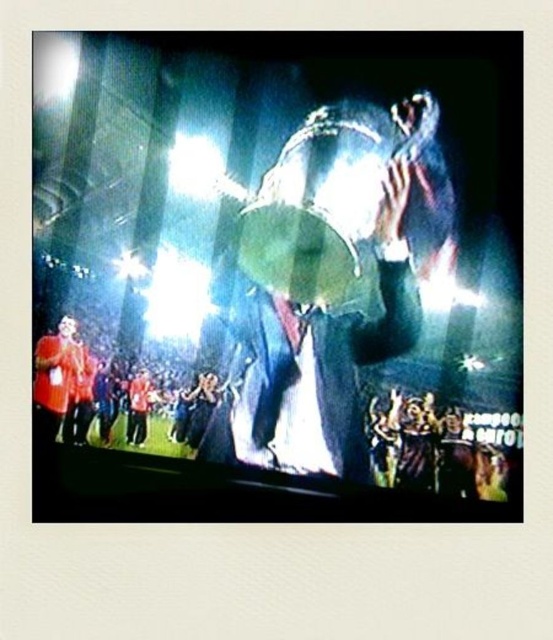
Question: Does metallic trophy at center appear on the right side of shiny silver drum at center?

Choices:
 (A) no
 (B) yes

Answer: (A)

Question: Which of the following is the closest to the observer?

Choices:
 (A) (267, 224)
 (B) (364, 173)

Answer: (B)

Question: Can you confirm if metallic trophy at center is positioned to the left of shiny silver drum at center?

Choices:
 (A) yes
 (B) no

Answer: (A)

Question: In this image, where is metallic trophy at center located relative to shiny silver drum at center?

Choices:
 (A) right
 (B) left

Answer: (B)

Question: Among these points, which one is farthest from the camera?

Choices:
 (A) (268, 465)
 (B) (432, 285)

Answer: (B)